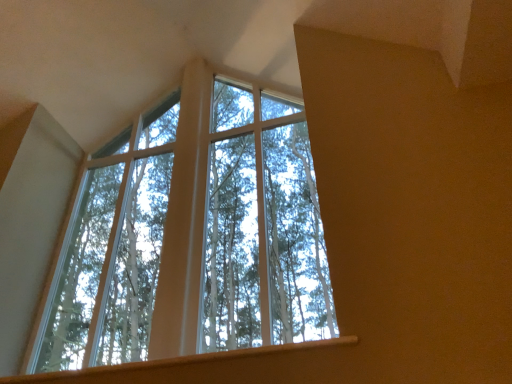
Image resolution: width=512 pixels, height=384 pixels. What do you see at coordinates (192, 235) in the screenshot?
I see `clear glass window at center` at bounding box center [192, 235].

The image size is (512, 384). Identify the location of clear glass window at center. pos(192,235).

Measure the distance between clear glass window at center and camera.

They are 1.57 meters apart.

What is the approximate height of smooth wood window sill at lower center?

4.30 centimeters.

Identify the location of smooth wood window sill at lower center. 187,361.

What do you see at coordinates (187, 361) in the screenshot? This screenshot has width=512, height=384. I see `smooth wood window sill at lower center` at bounding box center [187, 361].

I want to click on clear glass window at center, so click(x=192, y=235).

Which object is positioned more to the right, clear glass window at center or smooth wood window sill at lower center?

Positioned to the right is smooth wood window sill at lower center.

Is clear glass window at center behind smooth wood window sill at lower center?

Yes, it is behind smooth wood window sill at lower center.

Which is less distant, (39, 369) or (269, 381)?

The point (269, 381) is more forward.

From the image's perspective, which is below, clear glass window at center or smooth wood window sill at lower center?

From the image's view, smooth wood window sill at lower center is below.

From a real-world perspective, who is located lower, clear glass window at center or smooth wood window sill at lower center?

From a 3D spatial view, smooth wood window sill at lower center is below.

Is clear glass window at center wider than smooth wood window sill at lower center?

Incorrect, the width of clear glass window at center does not surpass that of smooth wood window sill at lower center.

Considering the sizes of clear glass window at center and smooth wood window sill at lower center in the image, is clear glass window at center taller or shorter than smooth wood window sill at lower center?

clear glass window at center is taller than smooth wood window sill at lower center.

Can you confirm if clear glass window at center is bigger than smooth wood window sill at lower center?

Yes.

Is clear glass window at center completely or partially outside of smooth wood window sill at lower center?

clear glass window at center lies outside smooth wood window sill at lower center's area.

From the picture: Is clear glass window at center placed right next to smooth wood window sill at lower center?

There is a gap between clear glass window at center and smooth wood window sill at lower center.

Is smooth wood window sill at lower center at the back of clear glass window at center?

No, clear glass window at center is not facing away from smooth wood window sill at lower center.

Locate an element on the screen. window behind the smooth wood window sill at lower center is located at coordinates (192, 235).

Can you confirm if smooth wood window sill at lower center is positioned to the right of clear glass window at center?

Correct, you'll find smooth wood window sill at lower center to the right of clear glass window at center.

Considering their positions, is smooth wood window sill at lower center located in front of or behind clear glass window at center?

Visually, smooth wood window sill at lower center is located in front of clear glass window at center.

Does point (160, 370) lie in front of point (157, 232)?

Yes, it is in front of point (157, 232).

From the image's perspective, does smooth wood window sill at lower center appear lower than clear glass window at center?

Yes, from the image's perspective, smooth wood window sill at lower center is below clear glass window at center.

From a real-world perspective, which object rests below the other?

smooth wood window sill at lower center.

Between smooth wood window sill at lower center and clear glass window at center, which one has smaller width?

clear glass window at center is thinner.

Between smooth wood window sill at lower center and clear glass window at center, which one has less height?

Standing shorter between the two is smooth wood window sill at lower center.

Does smooth wood window sill at lower center have a larger size compared to clear glass window at center?

Incorrect, smooth wood window sill at lower center is not larger than clear glass window at center.

Which is correct: smooth wood window sill at lower center is inside clear glass window at center, or outside of it?

smooth wood window sill at lower center is spatially situated outside clear glass window at center.

Is there a large distance between smooth wood window sill at lower center and clear glass window at center?

smooth wood window sill at lower center is positioned a significant distance from clear glass window at center.

Is smooth wood window sill at lower center oriented away from clear glass window at center?

smooth wood window sill at lower center does not have its back to clear glass window at center.

Can you tell me how much smooth wood window sill at lower center and clear glass window at center differ in facing direction?

The angular difference between smooth wood window sill at lower center and clear glass window at center is 0.0871 degrees.

Identify the location of window sill below the clear glass window at center (from the image's perspective). The image size is (512, 384). point(187,361).

In the image, there is a smooth wood window sill at lower center. What are the coordinates of `window above it (from the image's perspective)` in the screenshot? It's located at (192, 235).

The width and height of the screenshot is (512, 384). Find the location of `window lying on the left of smooth wood window sill at lower center`. window lying on the left of smooth wood window sill at lower center is located at coordinates (192, 235).